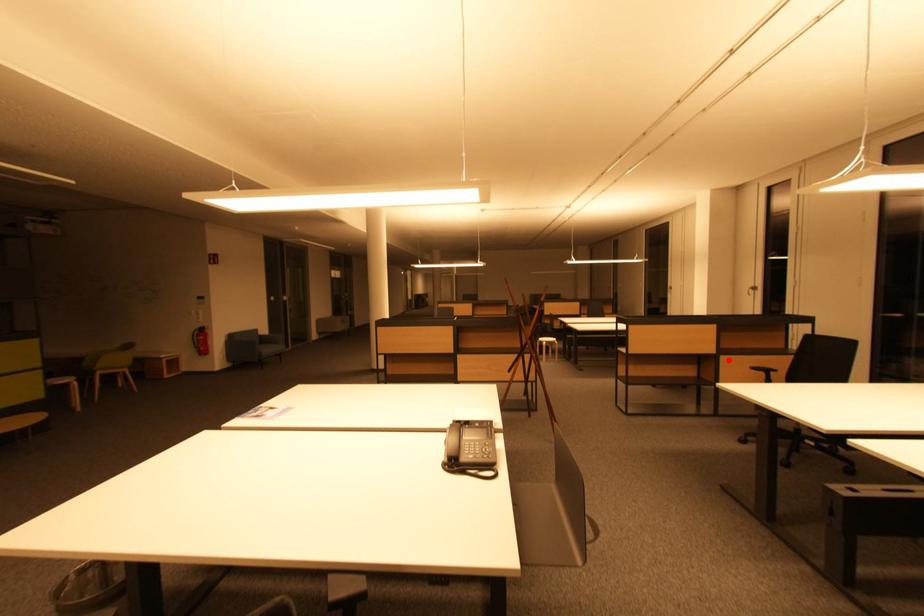
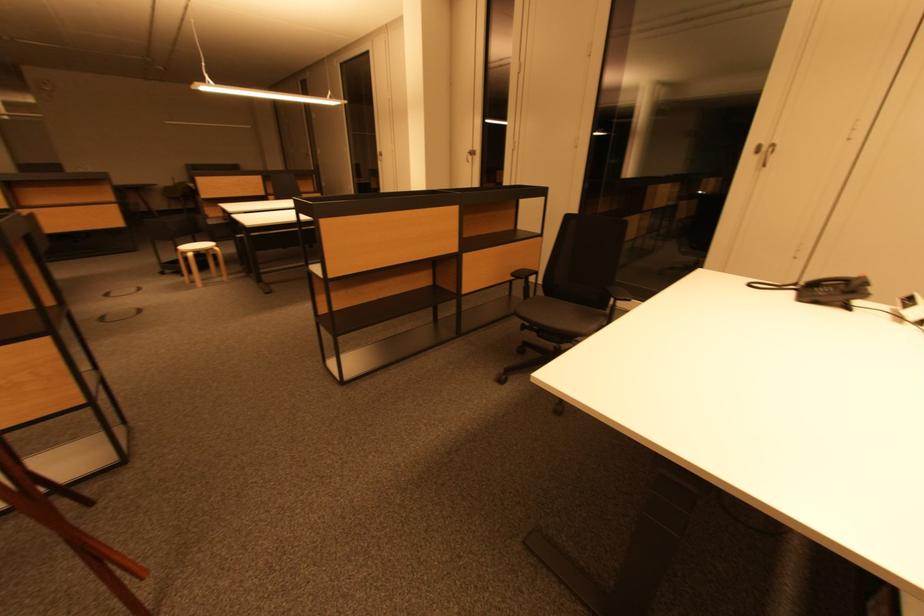
Find the pixel in the second image that matches the highlighted location in the first image.

(470, 259)